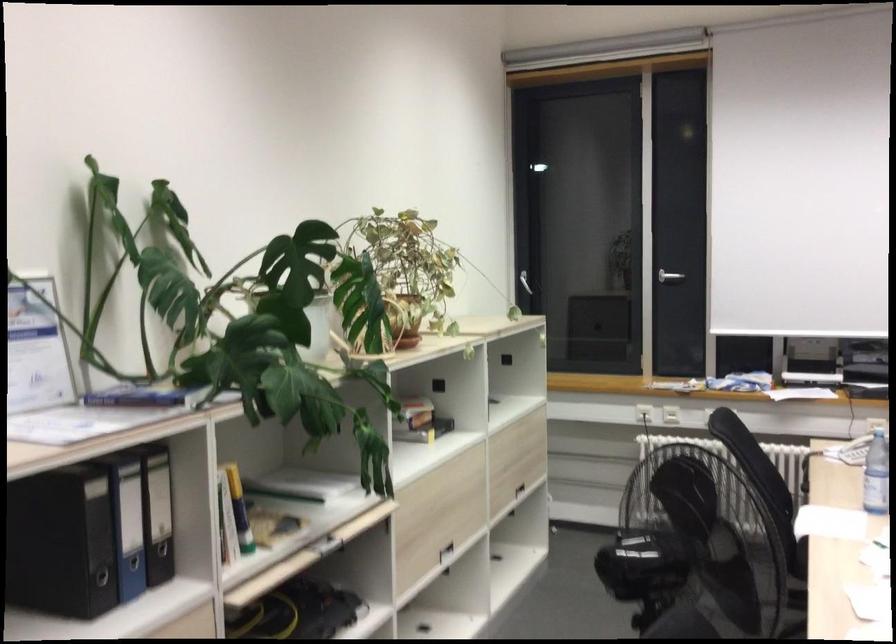
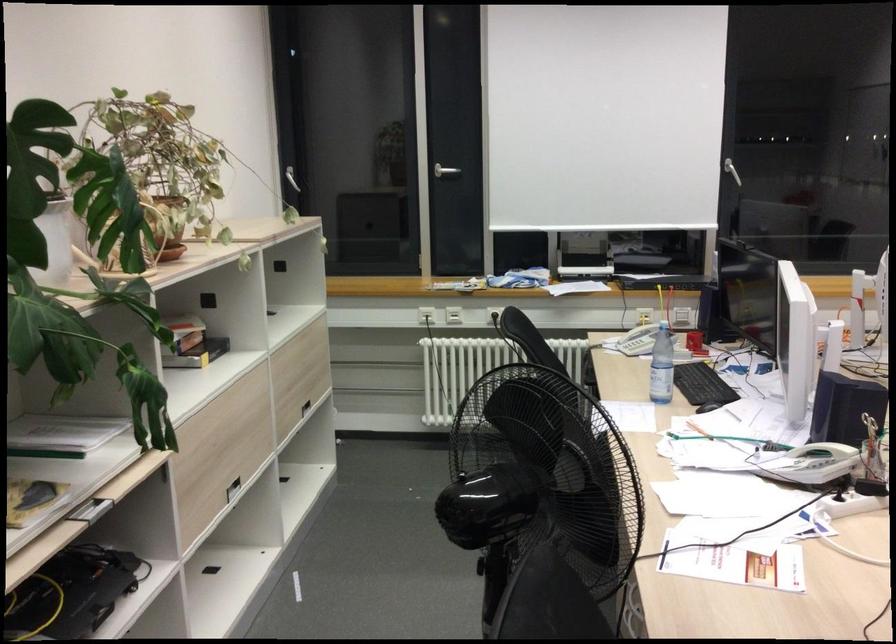
The point at [419,418] is marked in the first image. Where is the corresponding point in the second image?

(192, 343)